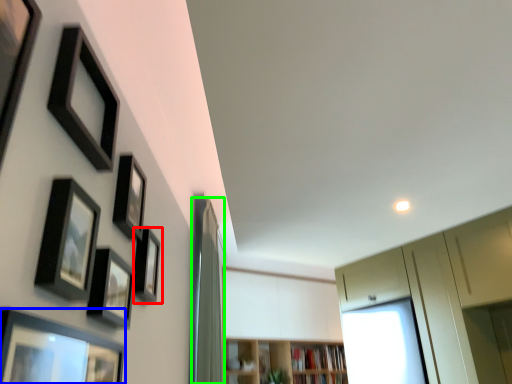
Question: Which object is positioned closest to picture frame (highlighted by a red box)? Select from picture frame (highlighted by a blue box) and curtain (highlighted by a green box).

Choices:
 (A) picture frame
 (B) curtain

Answer: (A)